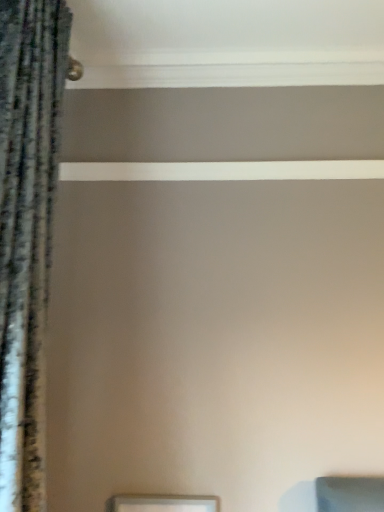
Question: From a real-world perspective, is matte silver picture frame at lower center below velvet-like dark gray curtain at left?

Choices:
 (A) yes
 (B) no

Answer: (A)

Question: From the image's perspective, is matte silver picture frame at lower center on top of velvet-like dark gray curtain at left?

Choices:
 (A) yes
 (B) no

Answer: (B)

Question: From the image's perspective, does matte silver picture frame at lower center appear lower than velvet-like dark gray curtain at left?

Choices:
 (A) yes
 (B) no

Answer: (A)

Question: Is matte silver picture frame at lower center positioned with its back to velvet-like dark gray curtain at left?

Choices:
 (A) no
 (B) yes

Answer: (A)

Question: Is matte silver picture frame at lower center positioned behind velvet-like dark gray curtain at left?

Choices:
 (A) yes
 (B) no

Answer: (A)

Question: Considering the relative sizes of matte silver picture frame at lower center and velvet-like dark gray curtain at left in the image provided, is matte silver picture frame at lower center taller than velvet-like dark gray curtain at left?

Choices:
 (A) yes
 (B) no

Answer: (B)

Question: Considering the relative sizes of velvet-like dark gray curtain at left and matte silver picture frame at lower center in the image provided, is velvet-like dark gray curtain at left shorter than matte silver picture frame at lower center?

Choices:
 (A) no
 (B) yes

Answer: (A)

Question: Can you confirm if velvet-like dark gray curtain at left is smaller than matte silver picture frame at lower center?

Choices:
 (A) yes
 (B) no

Answer: (B)

Question: Does velvet-like dark gray curtain at left have a larger size compared to matte silver picture frame at lower center?

Choices:
 (A) yes
 (B) no

Answer: (A)

Question: From a real-world perspective, does velvet-like dark gray curtain at left stand above matte silver picture frame at lower center?

Choices:
 (A) yes
 (B) no

Answer: (A)

Question: Does velvet-like dark gray curtain at left have a lesser width compared to matte silver picture frame at lower center?

Choices:
 (A) no
 (B) yes

Answer: (A)

Question: Is the surface of velvet-like dark gray curtain at left in direct contact with matte silver picture frame at lower center?

Choices:
 (A) no
 (B) yes

Answer: (A)

Question: Looking at the image, does velvet-like dark gray curtain at left seem bigger or smaller compared to matte silver picture frame at lower center?

Choices:
 (A) small
 (B) big

Answer: (B)